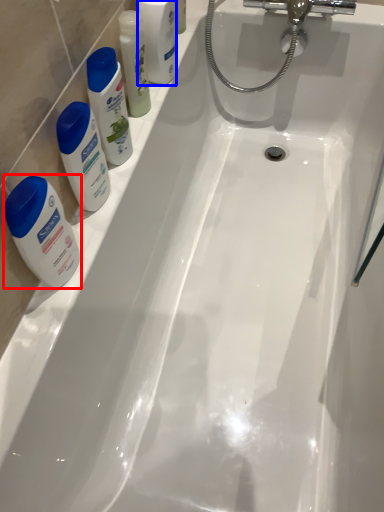
Question: Which object appears closest to the camera in this image, toiletry (highlighted by a red box) or mouthwash (highlighted by a blue box)?

Choices:
 (A) toiletry
 (B) mouthwash

Answer: (A)